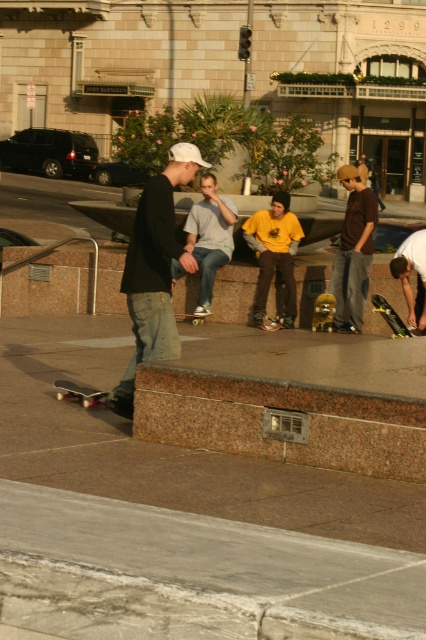
Does point (270, 244) come in front of point (58, 385)?

No, it is not.

Which is in front, point (262, 216) or point (72, 396)?

Positioned in front is point (72, 396).

Locate an element on the screen. The image size is (426, 640). yellow cotton hoodie at center is located at coordinates (273, 256).

The image size is (426, 640). What do you see at coordinates (78, 392) in the screenshot?
I see `dark gray matte skateboard at lower left` at bounding box center [78, 392].

Is dark gray matte skateboard at lower left below metallic gold skateboard at center?

Correct, dark gray matte skateboard at lower left is located below metallic gold skateboard at center.

The height and width of the screenshot is (640, 426). Identify the location of dark gray matte skateboard at lower left. (78, 392).

The height and width of the screenshot is (640, 426). What do you see at coordinates (155, 269) in the screenshot? I see `matte black skateboard at center` at bounding box center [155, 269].

Based on the photo, which is more to the left, matte black skateboard at center or metallic gold skateboard at center?

matte black skateboard at center

Is point (129, 241) farther from viewer compared to point (321, 298)?

No, it is in front of (321, 298).

The height and width of the screenshot is (640, 426). Identify the location of matte black skateboard at center. (155, 269).